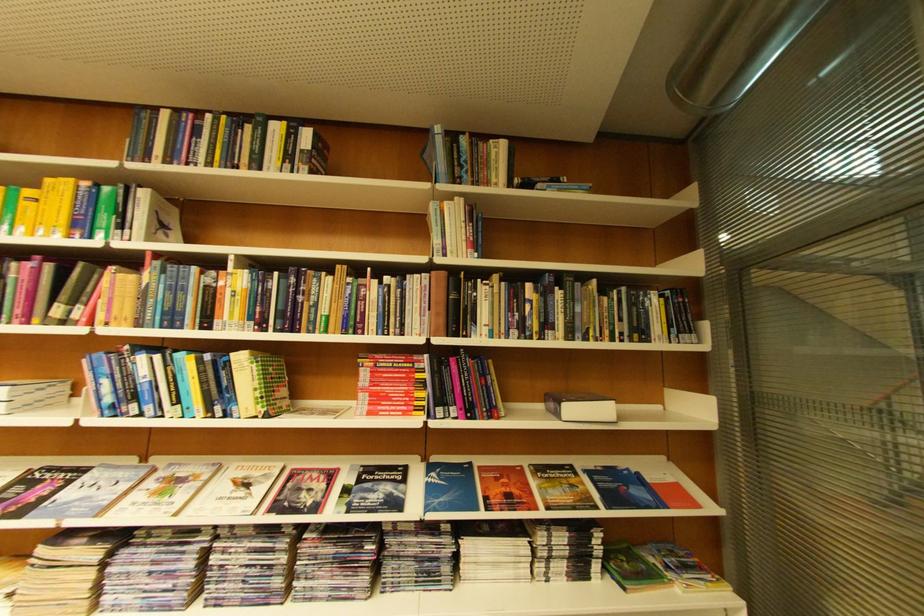
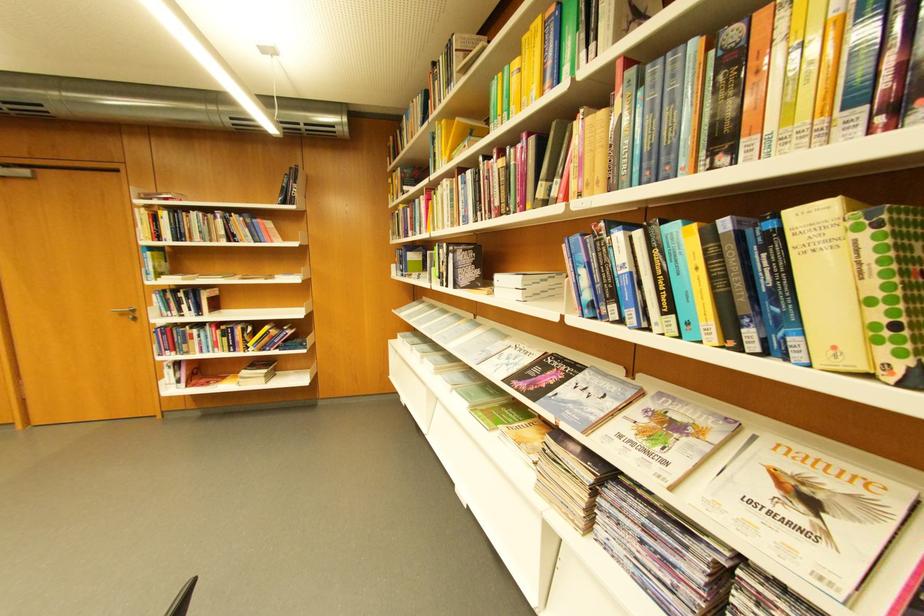
Find the pixel in the second image that matches [242,355] in the first image.

(796, 214)